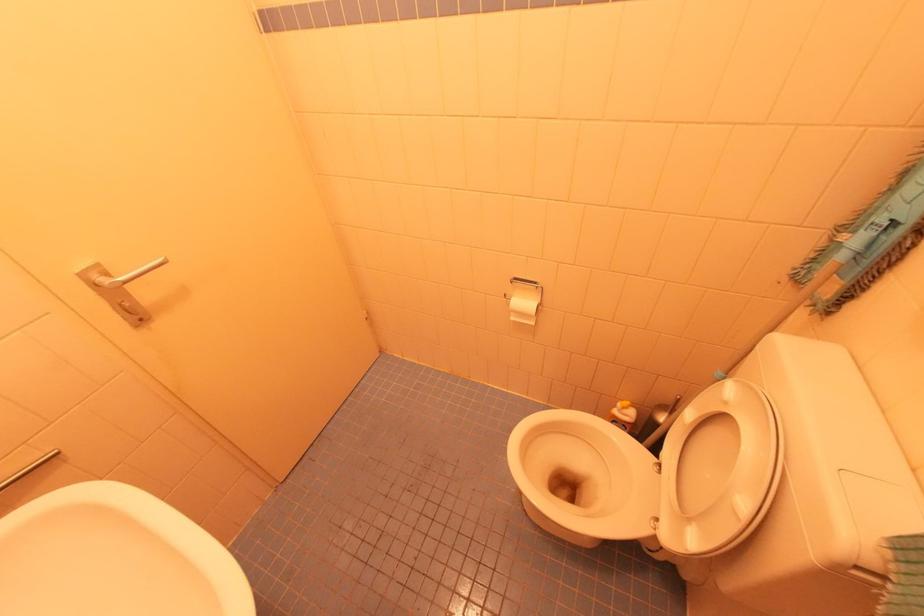
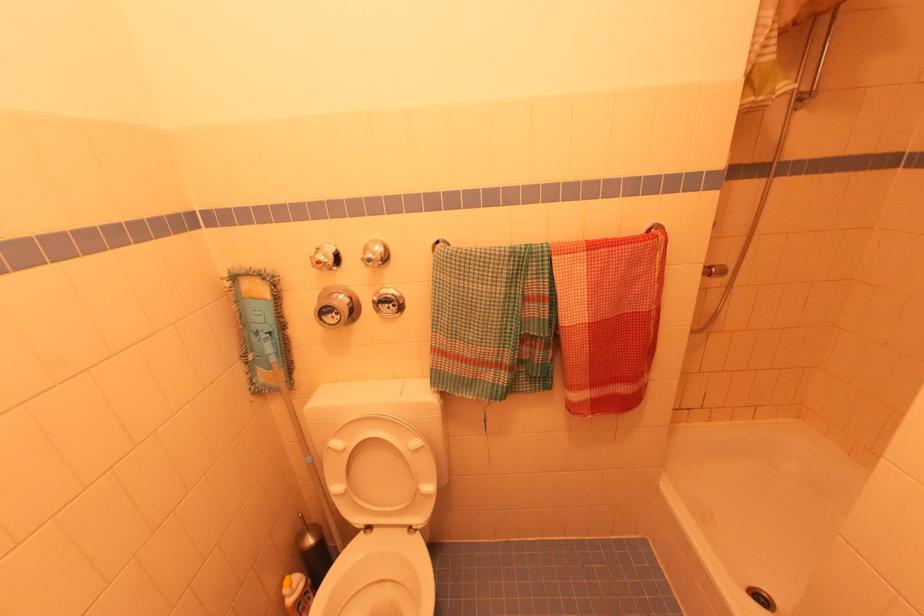
Locate, in the second image, the point that corresponds to [626,411] in the first image.

(296, 585)